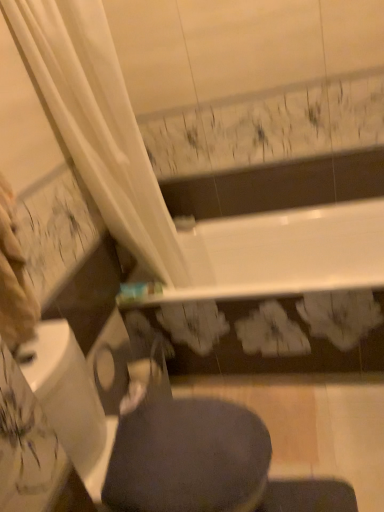
The width and height of the screenshot is (384, 512). Identify the location of free space above dark gray fabric at lower center (from a real-world perspective). (189, 441).